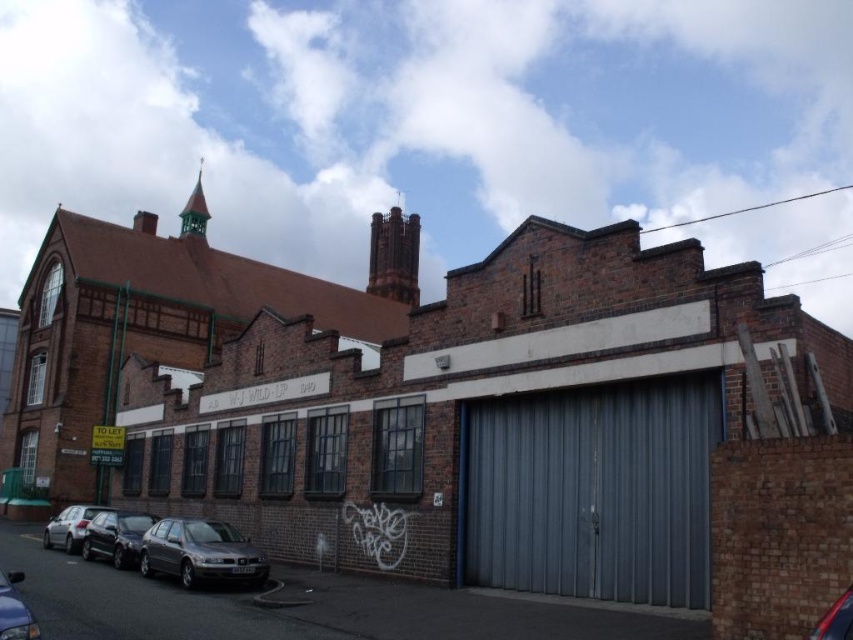
How far apart are metallic gray sedan at lower left and metallic gray car at lower left?

The distance of metallic gray sedan at lower left from metallic gray car at lower left is 28.74 feet.

Can you confirm if metallic gray sedan at lower left is positioned to the left of metallic gray car at lower left?

In fact, metallic gray sedan at lower left is to the right of metallic gray car at lower left.

Is point (146, 552) closer to viewer compared to point (10, 637)?

No, it is not.

Locate an element on the screen. metallic gray sedan at lower left is located at coordinates (200, 554).

Describe the element at coordinates (200, 554) in the screenshot. Image resolution: width=853 pixels, height=640 pixels. I see `metallic gray sedan at lower left` at that location.

Is metallic gray sedan at lower left taller than shiny black car at lower left?

No, metallic gray sedan at lower left is not taller than shiny black car at lower left.

Is point (144, 572) positioned before point (122, 545)?

Yes, it is in front of point (122, 545).

The width and height of the screenshot is (853, 640). In order to click on metallic gray sedan at lower left in this screenshot , I will do pyautogui.click(x=200, y=554).

In the scene shown: Is metallic gray car at lower left further to the viewer compared to silver metallic car at lower left?

No, it is not.

The width and height of the screenshot is (853, 640). What do you see at coordinates (15, 611) in the screenshot?
I see `metallic gray car at lower left` at bounding box center [15, 611].

Is point (25, 612) positioned after point (47, 547)?

No, it is not.

Find the location of `metallic gray car at lower left`. metallic gray car at lower left is located at coordinates pos(15,611).